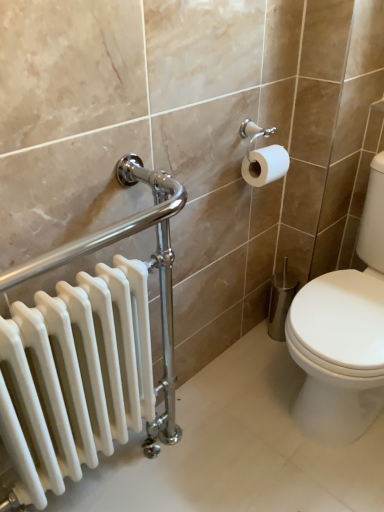
Question: From a real-world perspective, is white glossy toilet at right physically above white matte toilet paper at upper right?

Choices:
 (A) no
 (B) yes

Answer: (A)

Question: Can we say white glossy toilet at right lies outside white matte toilet paper at upper right?

Choices:
 (A) yes
 (B) no

Answer: (A)

Question: Is white glossy toilet at right beside white matte toilet paper at upper right?

Choices:
 (A) yes
 (B) no

Answer: (B)

Question: Could you tell me if white glossy toilet at right is facing white matte toilet paper at upper right?

Choices:
 (A) yes
 (B) no

Answer: (B)

Question: Does white glossy toilet at right contain white matte toilet paper at upper right?

Choices:
 (A) yes
 (B) no

Answer: (B)

Question: Based on their positions, is white glossy radiator at left located to the left or right of white matte toilet paper at upper right?

Choices:
 (A) right
 (B) left

Answer: (B)

Question: Is point (117, 296) closer or farther from the camera than point (264, 182)?

Choices:
 (A) farther
 (B) closer

Answer: (B)

Question: In the image, is white glossy radiator at left positioned in front of or behind white matte toilet paper at upper right?

Choices:
 (A) behind
 (B) front

Answer: (B)

Question: From a real-world perspective, is white glossy radiator at left physically located above or below white matte toilet paper at upper right?

Choices:
 (A) above
 (B) below

Answer: (B)

Question: Relative to white glossy radiator at left, is white matte toilet paper at upper right in front or behind?

Choices:
 (A) behind
 (B) front

Answer: (A)

Question: From the image's perspective, relative to white glossy radiator at left, is white matte toilet paper at upper right above or below?

Choices:
 (A) above
 (B) below

Answer: (A)

Question: Choose the correct answer: Is white matte toilet paper at upper right inside white glossy radiator at left or outside it?

Choices:
 (A) inside
 (B) outside

Answer: (B)

Question: From a real-world perspective, is white matte toilet paper at upper right above or below white glossy radiator at left?

Choices:
 (A) above
 (B) below

Answer: (A)

Question: Is white glossy radiator at left in front of or behind white glossy toilet at right in the image?

Choices:
 (A) behind
 (B) front

Answer: (B)

Question: Choose the correct answer: Is white glossy radiator at left inside white glossy toilet at right or outside it?

Choices:
 (A) inside
 (B) outside

Answer: (B)